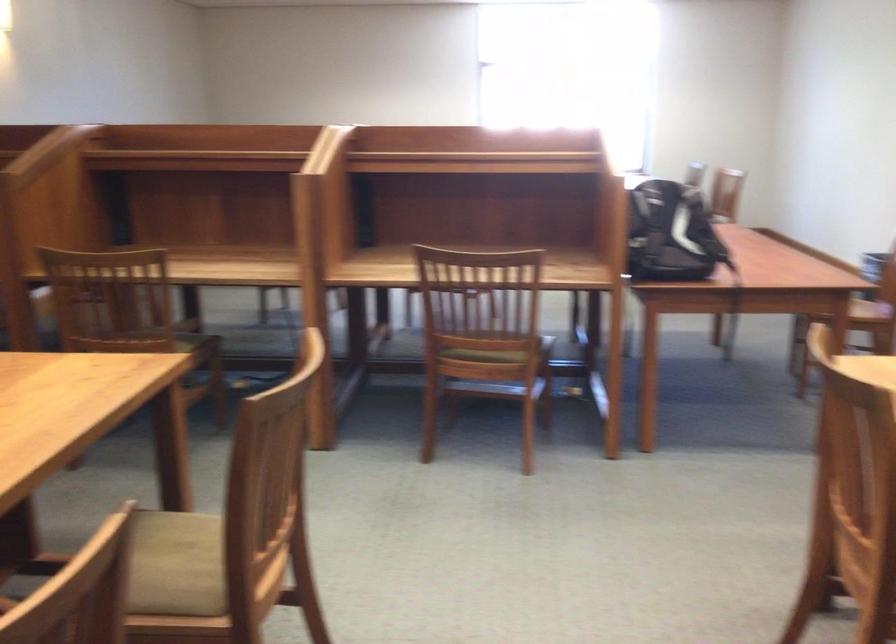
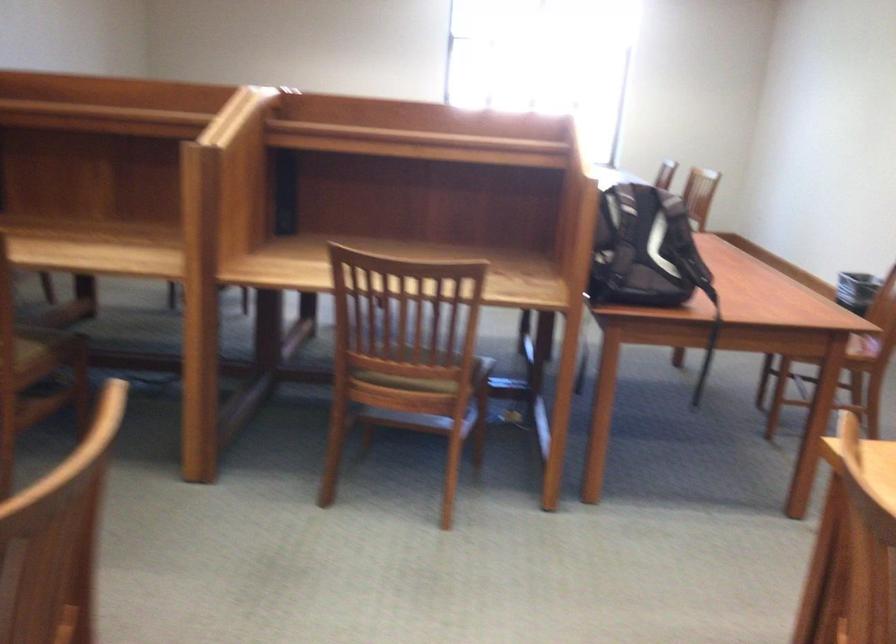
In the second image, find the point that corresponds to (675,230) in the first image.

(644, 250)